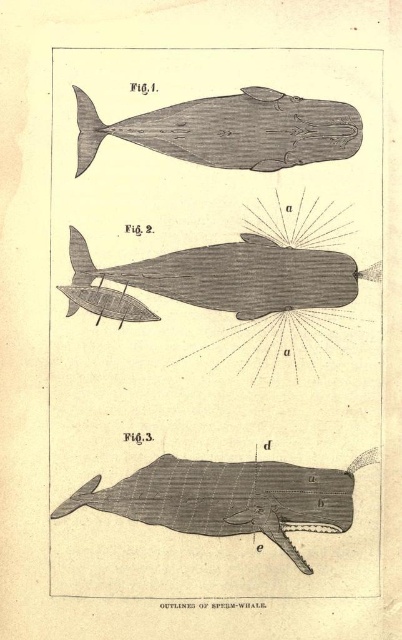
Which is below, grid-patterned whale at bottom or gray wood humpback whale at center?

grid-patterned whale at bottom

Image resolution: width=402 pixels, height=640 pixels. What do you see at coordinates (229, 499) in the screenshot?
I see `grid-patterned whale at bottom` at bounding box center [229, 499].

You are a GUI agent. You are given a task and a screenshot of the screen. Output one action in this format:
    pyautogui.click(x=<x>, y=<y>)
    Task: Click on the grid-patterned whale at bottom
    The height and width of the screenshot is (640, 402).
    Given the screenshot: What is the action you would take?
    pyautogui.click(x=229, y=499)

Does gray textured whale at center appear on the right side of gray wood humpback whale at center?

Incorrect, gray textured whale at center is not on the right side of gray wood humpback whale at center.

Between point (71, 296) and point (258, 129), which one is positioned in front?

Point (258, 129) is more forward.

The image size is (402, 640). I want to click on gray textured whale at center, so click(x=235, y=291).

Does gray textured whale at center appear over grid-patterned whale at bottom?

Yes.

Is gray textured whale at center to the left of grid-patterned whale at bottom from the viewer's perspective?

Incorrect, gray textured whale at center is not on the left side of grid-patterned whale at bottom.

Who is more forward, [309,147] or [278,486]?

Positioned in front is point [309,147].

In order to click on gray textured whale at center in this screenshot , I will do `click(235, 291)`.